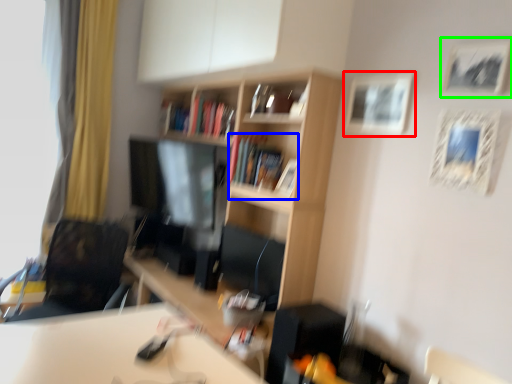
Question: Which object is the farthest from picture frame (highlighted by a red box)? Choose among these: book (highlighted by a blue box) or picture frame (highlighted by a green box).

Choices:
 (A) book
 (B) picture frame

Answer: (A)